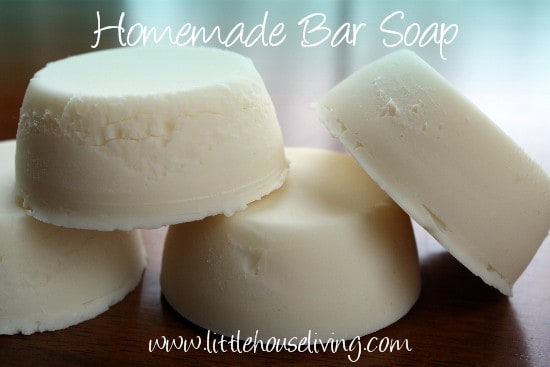
Locate an element on the screen. The width and height of the screenshot is (550, 367). soap is located at coordinates (214, 166).